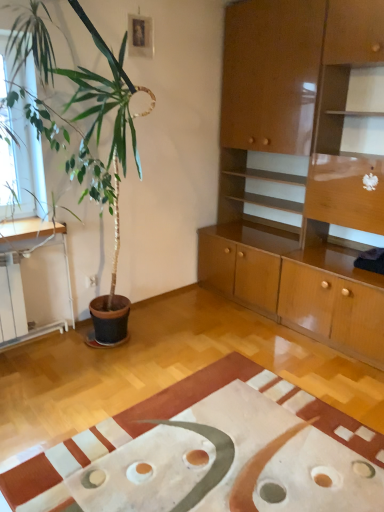
Identify the location of glossy wood cabinet at upper right. (297, 170).

What do you see at coordinates (297, 170) in the screenshot?
I see `glossy wood cabinet at upper right` at bounding box center [297, 170].

What do you see at coordinates (211, 453) in the screenshot? I see `white matte rug at lower center` at bounding box center [211, 453].

Where is `white matte rug at lower center`? The image size is (384, 512). white matte rug at lower center is located at coordinates (211, 453).

In the scene shown: Measure the distance between point [275,393] and camera.

Point [275,393] is 2.44 meters away from camera.

Identify the location of glossy wood cabinet at upper right. (297, 170).

Is white matte rug at lower center at the left side of glossy wood cabinet at upper right?

Correct, you'll find white matte rug at lower center to the left of glossy wood cabinet at upper right.

Who is more distant, white matte rug at lower center or glossy wood cabinet at upper right?

glossy wood cabinet at upper right is further away from the camera.

Considering the positions of points (276, 498) and (261, 157), is point (276, 498) closer to camera compared to point (261, 157)?

Yes, point (276, 498) is closer to viewer.

From the image's perspective, is white matte rug at lower center above or below glossy wood cabinet at upper right?

white matte rug at lower center is below glossy wood cabinet at upper right.

From a real-world perspective, which is physically above, white matte rug at lower center or glossy wood cabinet at upper right?

glossy wood cabinet at upper right.

Between white matte rug at lower center and glossy wood cabinet at upper right, which one has larger width?

Wider between the two is white matte rug at lower center.

Does white matte rug at lower center have a greater height compared to glossy wood cabinet at upper right?

In fact, white matte rug at lower center may be shorter than glossy wood cabinet at upper right.

Does white matte rug at lower center have a larger size compared to glossy wood cabinet at upper right?

Actually, white matte rug at lower center might be smaller than glossy wood cabinet at upper right.

Is glossy wood cabinet at upper right inside white matte rug at lower center?

No, glossy wood cabinet at upper right is not surrounded by white matte rug at lower center.

Would you say white matte rug at lower center is a long distance from glossy wood cabinet at upper right?

Indeed, white matte rug at lower center is not near glossy wood cabinet at upper right.

Is white matte rug at lower center oriented towards glossy wood cabinet at upper right?

No, white matte rug at lower center does not turn towards glossy wood cabinet at upper right.

How different are the orientations of white matte rug at lower center and glossy wood cabinet at upper right in degrees?

1.48 degrees separate the facing orientations of white matte rug at lower center and glossy wood cabinet at upper right.

At what (x,y) coordinates should I click in order to perform the action: click on plain on the left of glossy wood cabinet at upper right. Please return your answer as a coordinate pair (x, y). Looking at the image, I should click on (211, 453).

Which is more to the left, glossy wood cabinet at upper right or white matte rug at lower center?

From the viewer's perspective, white matte rug at lower center appears more on the left side.

In the image, is glossy wood cabinet at upper right positioned in front of or behind white matte rug at lower center?

Clearly, glossy wood cabinet at upper right is behind white matte rug at lower center.

Between point (264, 275) and point (361, 466), which one is positioned in front?

Positioned in front is point (361, 466).

From the image's perspective, is glossy wood cabinet at upper right above white matte rug at lower center?

Yes, from the image's perspective, glossy wood cabinet at upper right is on top of white matte rug at lower center.

From a real-world perspective, between glossy wood cabinet at upper right and white matte rug at lower center, who is vertically higher?

From a 3D spatial view, glossy wood cabinet at upper right is above.

From the picture: Can you confirm if glossy wood cabinet at upper right is wider than white matte rug at lower center?

No.

Is glossy wood cabinet at upper right taller than white matte rug at lower center?

Yes.

Can you confirm if glossy wood cabinet at upper right is bigger than white matte rug at lower center?

Yes.

Is white matte rug at lower center completely or partially inside glossy wood cabinet at upper right?

Definitely not — white matte rug at lower center is not inside glossy wood cabinet at upper right.

Would you say glossy wood cabinet at upper right is a long distance from white matte rug at lower center?

Yes, glossy wood cabinet at upper right and white matte rug at lower center are quite far apart.

Could you tell me if glossy wood cabinet at upper right is facing white matte rug at lower center?

No, glossy wood cabinet at upper right is not oriented towards white matte rug at lower center.

How many degrees apart are the facing directions of glossy wood cabinet at upper right and white matte rug at lower center?

glossy wood cabinet at upper right and white matte rug at lower center are facing 1.48 degrees away from each other.

The image size is (384, 512). Find the location of `plain that is on the left side of glossy wood cabinet at upper right`. plain that is on the left side of glossy wood cabinet at upper right is located at coordinates (211, 453).

Image resolution: width=384 pixels, height=512 pixels. What are the coordinates of `cabinetry behind the white matte rug at lower center` in the screenshot? It's located at (297, 170).

You are a GUI agent. You are given a task and a screenshot of the screen. Output one action in this format:
    pyautogui.click(x=<x>, y=<y>)
    Task: Click on the plain that appears in front of the glossy wood cabinet at upper right
    The image size is (384, 512).
    Given the screenshot: What is the action you would take?
    pyautogui.click(x=211, y=453)